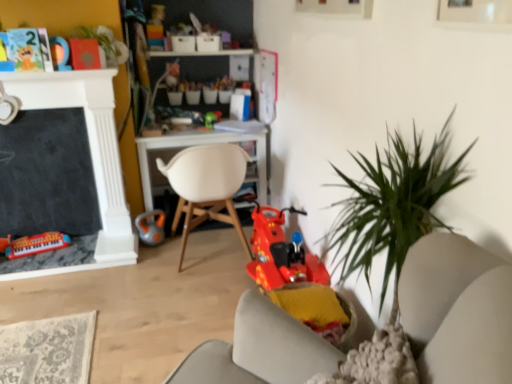
Locate an element on the screen. vacant location below orange rubber kettlebell at center, the third toy positioned from the bottom (from a real-world perspective) is located at coordinates (156, 242).